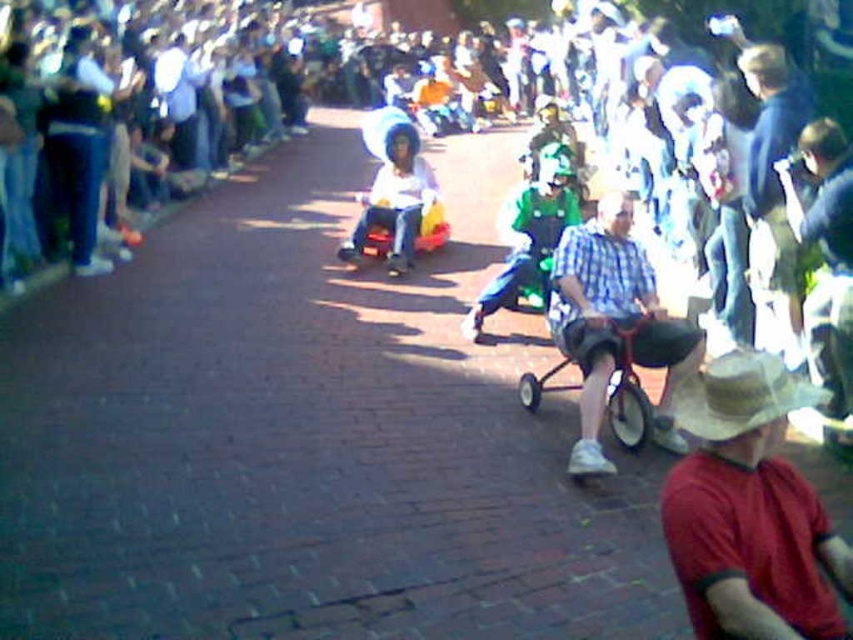
Question: Which point is closer to the camera?

Choices:
 (A) (704, 518)
 (B) (389, 157)

Answer: (A)

Question: Is checkered fabric shirt at center in front of brown straw cowboy hat at lower right?

Choices:
 (A) no
 (B) yes

Answer: (A)

Question: Which object is farther from the camera taking this photo?

Choices:
 (A) metallic silver stroller at center
 (B) brown straw cowboy hat at lower right
 (C) checkered fabric shirt at center

Answer: (A)

Question: Does straw hat at center appear under brown straw cowboy hat at lower right?

Choices:
 (A) no
 (B) yes

Answer: (B)

Question: Considering the real-world distances, which object is closest to the straw hat at center?

Choices:
 (A) brown straw cowboy hat at lower right
 (B) metallic silver stroller at center
 (C) green fabric costume at center
 (D) matte plastic baby carriage at center

Answer: (A)

Question: Can you confirm if checkered fabric shirt at center is positioned above matte plastic baby carriage at center?

Choices:
 (A) no
 (B) yes

Answer: (A)